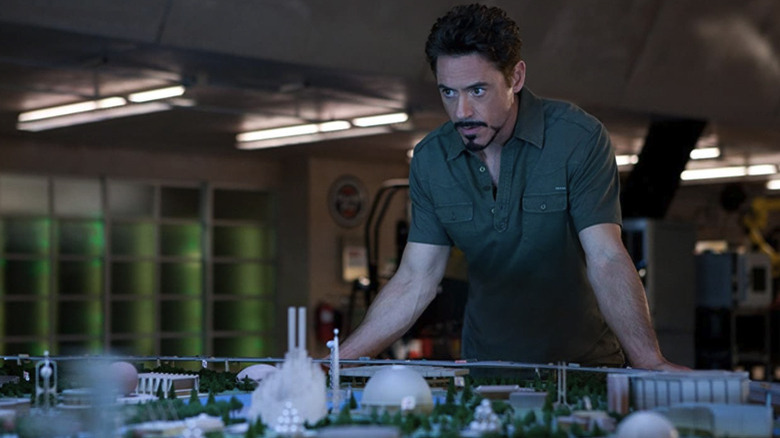
Find the location of a particular element. This screenshot has height=438, width=780. lights on ceiling is located at coordinates (73, 119), (133, 106), (277, 140), (384, 117), (729, 173), (704, 152), (625, 158), (775, 184).